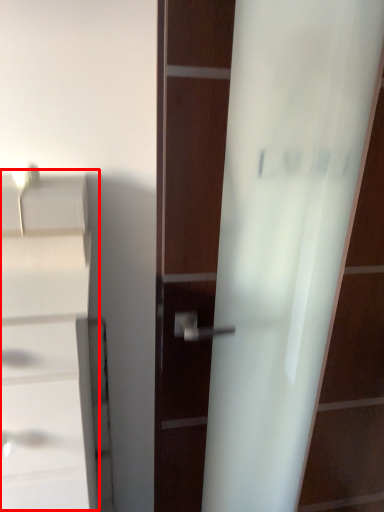
Question: From the image's perspective, what is the correct spatial relationship of cabinetry (annotated by the red box) in relation to screen door?

Choices:
 (A) above
 (B) below

Answer: (B)